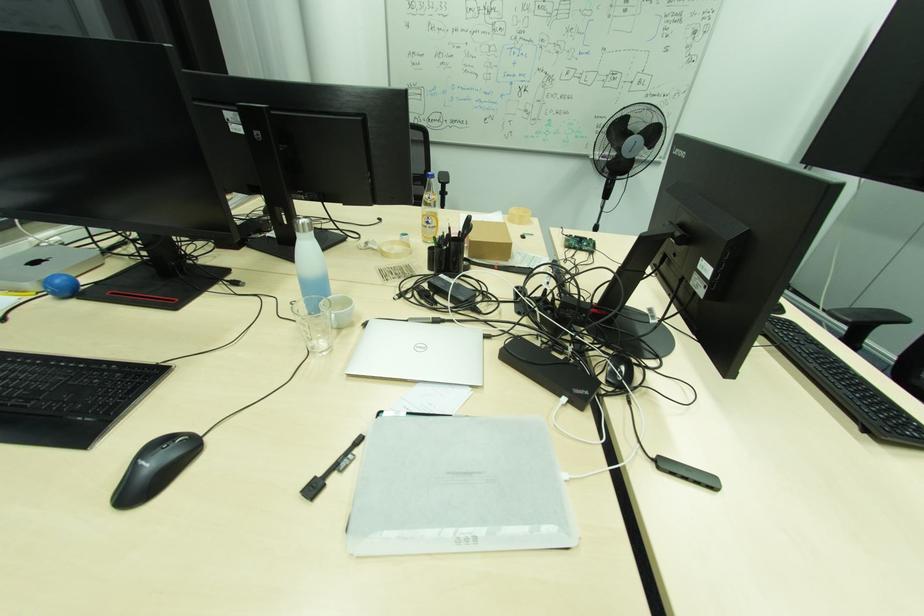
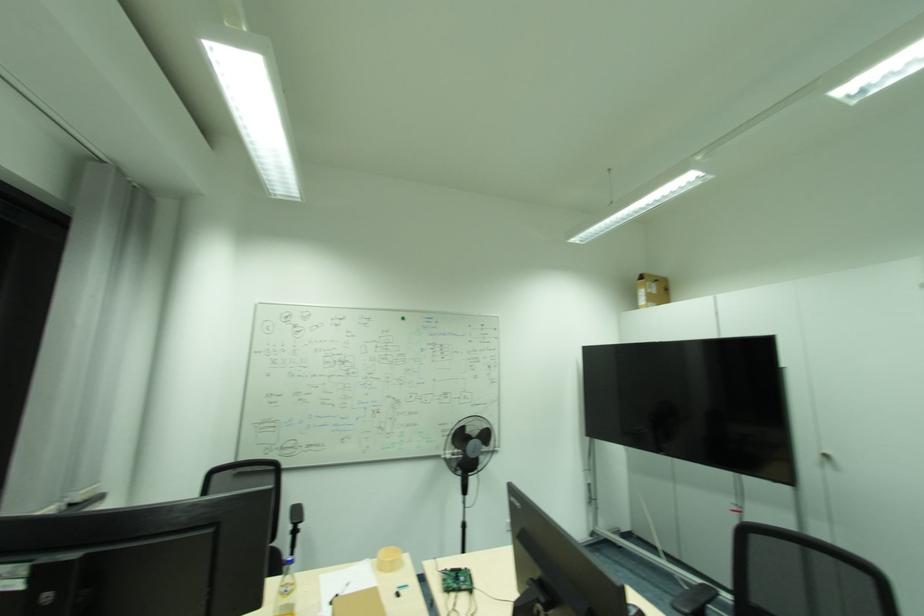
In the second image, find the point that corresponds to pixel 517 209 in the first image.

(386, 553)